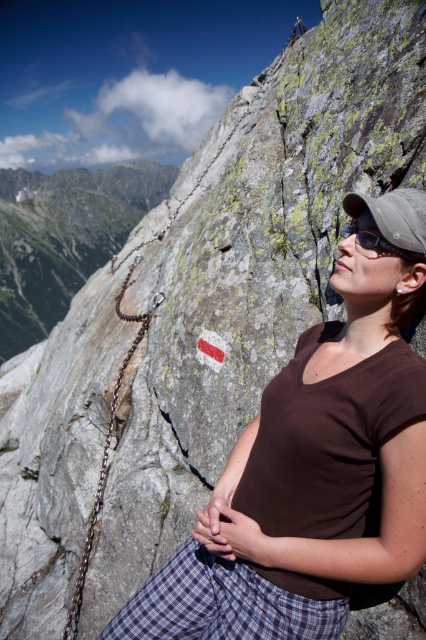
Can you confirm if brown cotton shirt at center is positioned below black matte goggles at upper right?

Yes.

Who is more forward, (325, 352) or (379, 244)?

Point (379, 244) is more forward.

I want to click on brown cotton shirt at center, so click(x=307, y=483).

Is point (382, 422) closer to viewer compared to point (417, 298)?

Yes, it is.

You are a GUI agent. You are given a task and a screenshot of the screen. Output one action in this format:
    pyautogui.click(x=<x>, y=<y>)
    Task: Click on the brown cotton shirt at center
    
    Given the screenshot: What is the action you would take?
    pyautogui.click(x=307, y=483)

Is point (310, 612) less distant than point (60, 268)?

Yes, point (310, 612) is in front of point (60, 268).

Locate an element on the screen. The image size is (426, 640). brown cotton shirt at center is located at coordinates (307, 483).

Who is more distant from viewer, (x=377, y=260) or (x=28, y=333)?

Positioned behind is point (x=28, y=333).

Identify the location of brown cotton shirt at center. This screenshot has height=640, width=426. (307, 483).